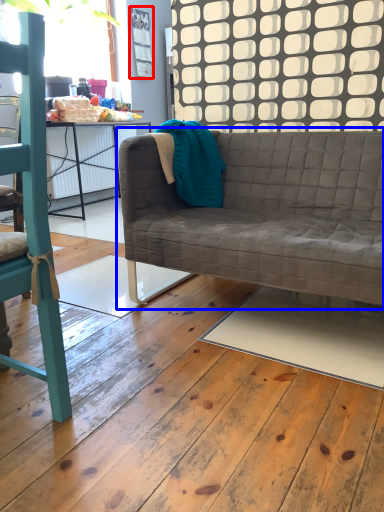
Question: Which object is closer to the camera taking this photo, bulletin board (highlighted by a red box) or studio couch (highlighted by a blue box)?

Choices:
 (A) bulletin board
 (B) studio couch

Answer: (B)